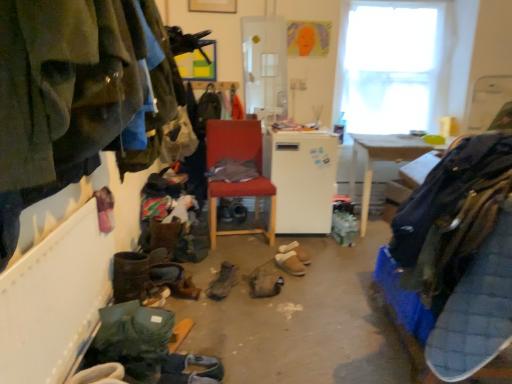
At what (x,y) coordinates should I click in order to perform the action: click on empty space that is ontop of transparent glass window at upper right. Please return your answer as a coordinate pair (x, y). This screenshot has width=512, height=384. Looking at the image, I should click on (395, 4).